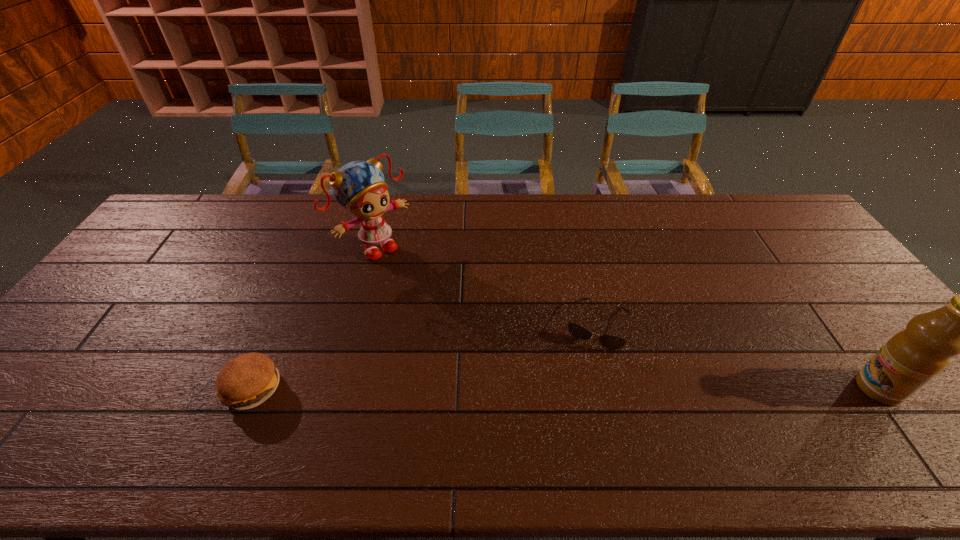
Where is `hamburger`? This screenshot has height=540, width=960. hamburger is located at coordinates (245, 382).

The height and width of the screenshot is (540, 960). What are the coordinates of `the leftmost object` in the screenshot? It's located at (245, 382).

At what (x,y) coordinates should I click in order to perform the action: click on the rightmost object. Please return your answer as a coordinate pair (x, y). Looking at the image, I should click on (911, 358).

Identify the location of the shortest object. This screenshot has width=960, height=540. point(579,332).

Where is `the second object from right to left`? This screenshot has height=540, width=960. the second object from right to left is located at coordinates (579, 332).

Find the location of `the second object from left to right`. the second object from left to right is located at coordinates (359, 186).

I want to click on the farthest object, so click(359, 186).

In order to click on free region located 0.290m on the left of the hamburger in this screenshot , I will do `click(106, 388)`.

The image size is (960, 540). I want to click on free point located on the label of the olive oil, so click(x=691, y=388).

Identify the location of vacant area situated on the label of the olive oil. This screenshot has width=960, height=540. (691, 388).